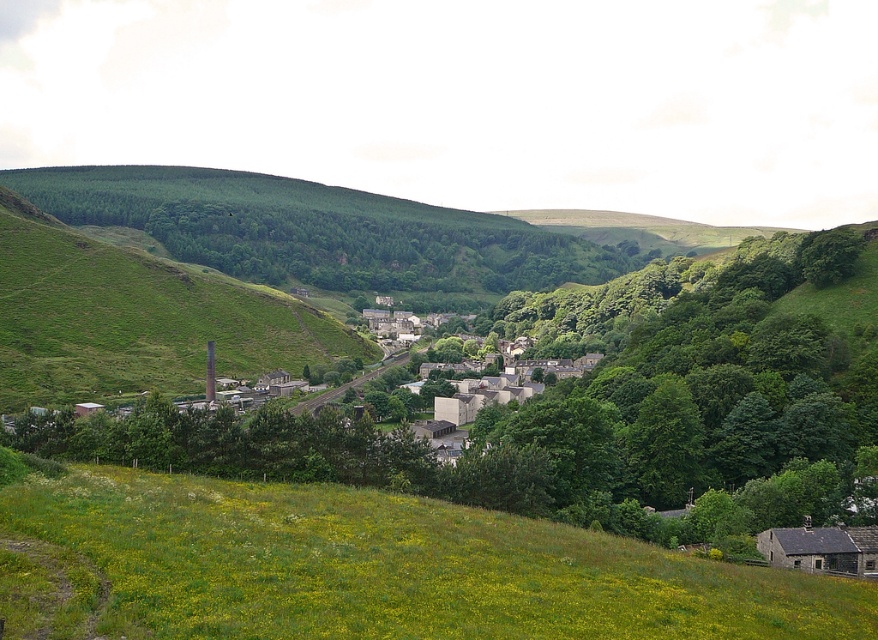
Does point (497, 540) lie in front of point (157, 257)?

That is True.

Between green grassy hillside at lower center and green grassy hillside at left, which one is positioned lower?

green grassy hillside at lower center

Where is `green grassy hillside at lower center`? Image resolution: width=878 pixels, height=640 pixels. green grassy hillside at lower center is located at coordinates 396,566.